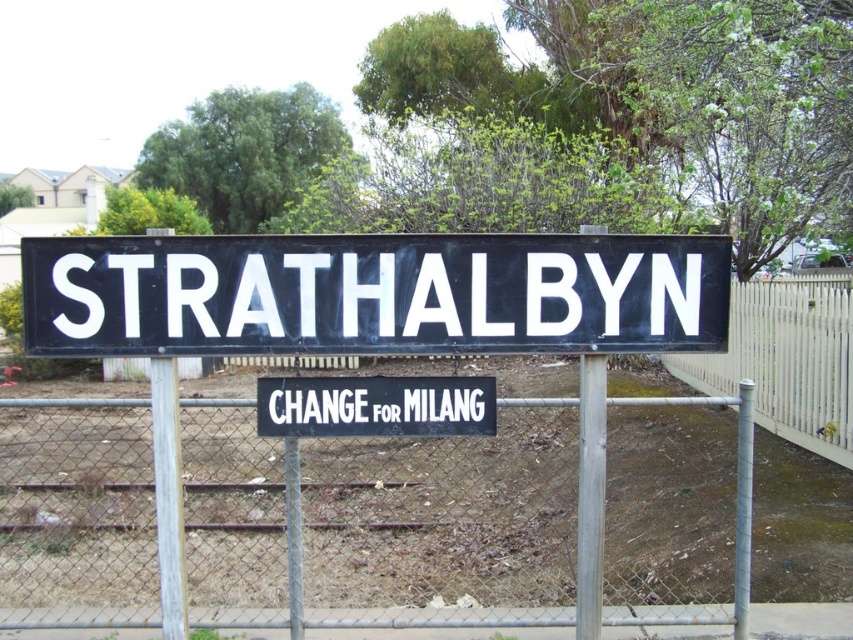
Looking at this image, you are a photographer standing in front of the railway station sign for Strathalbyn. You want to take a photo that includes both the black matte sign at center and the white wood pole at center. Which object should you focus on first to ensure both are in sharp focus?

The black matte sign at center is closer to the viewer than the white wood pole at center. To ensure both are in sharp focus, you should focus on the black matte sign at center first, as it is the closer object.

You are a maintenance worker inspecting the area around the railway station sign. You notice the white picket fence at right and the silver metallic pole at right. Which structure is shorter?

The white picket fence at right is shorter than the silver metallic pole at right.